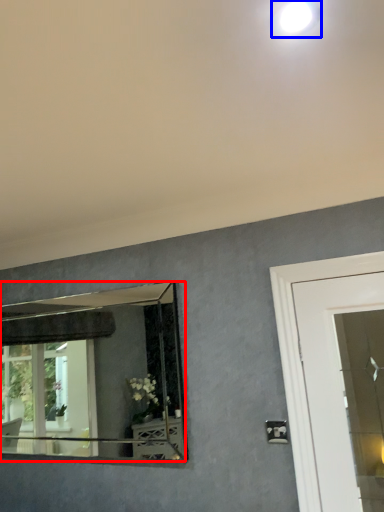
Question: Which of the following is the closest to the observer, mirror (highlighted by a red box) or droplight (highlighted by a blue box)?

Choices:
 (A) mirror
 (B) droplight

Answer: (B)